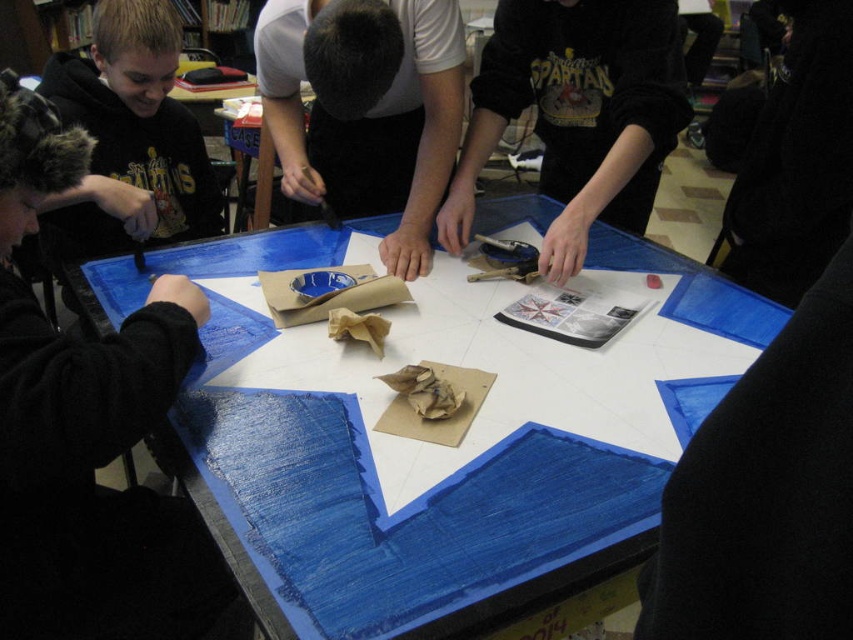
Question: Which of these objects is positioned farthest from the black cotton sweatshirt at upper center?

Choices:
 (A) white matte paper at center
 (B) matte black hoodie at left

Answer: (B)

Question: Can you confirm if black cotton sweatshirt at upper center is thinner than matte black hoodie at left?

Choices:
 (A) yes
 (B) no

Answer: (B)

Question: Which of the following is the closest to the observer?

Choices:
 (A) (556, 28)
 (B) (91, 120)
 (C) (306, 232)
 (D) (352, 134)

Answer: (A)

Question: Is blue painted wood table at center further to the viewer compared to black cotton sweatshirt at upper center?

Choices:
 (A) no
 (B) yes

Answer: (A)

Question: Which object is farther from the camera taking this photo?

Choices:
 (A) blue painted wood table at center
 (B) black cotton sweatshirt at upper center
 (C) matte black hoodie at left
 (D) white matte paper at center

Answer: (B)

Question: Is white matte paper at center above matte black hoodie at left?

Choices:
 (A) yes
 (B) no

Answer: (B)